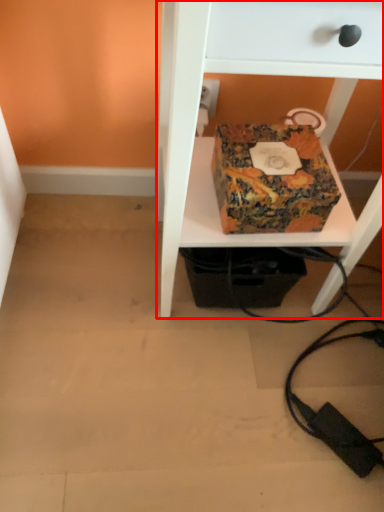
Question: From the image's perspective, considering the relative positions of furniture (annotated by the red box) and box in the image provided, where is furniture (annotated by the red box) located with respect to the staircase?

Choices:
 (A) above
 (B) below

Answer: (A)